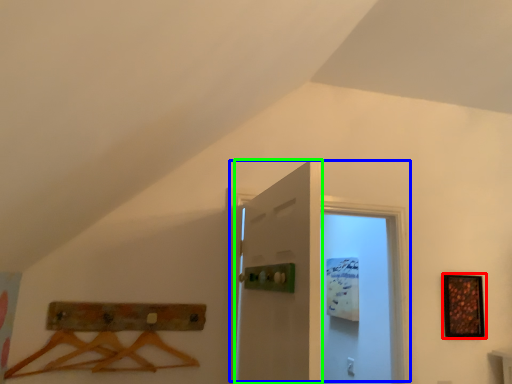
Question: Estimate the real-world distances between objects in this image. Which object is farther from picture frame (highlighted by a red box), door (highlighted by a blue box) or door (highlighted by a green box)?

Choices:
 (A) door
 (B) door

Answer: (B)